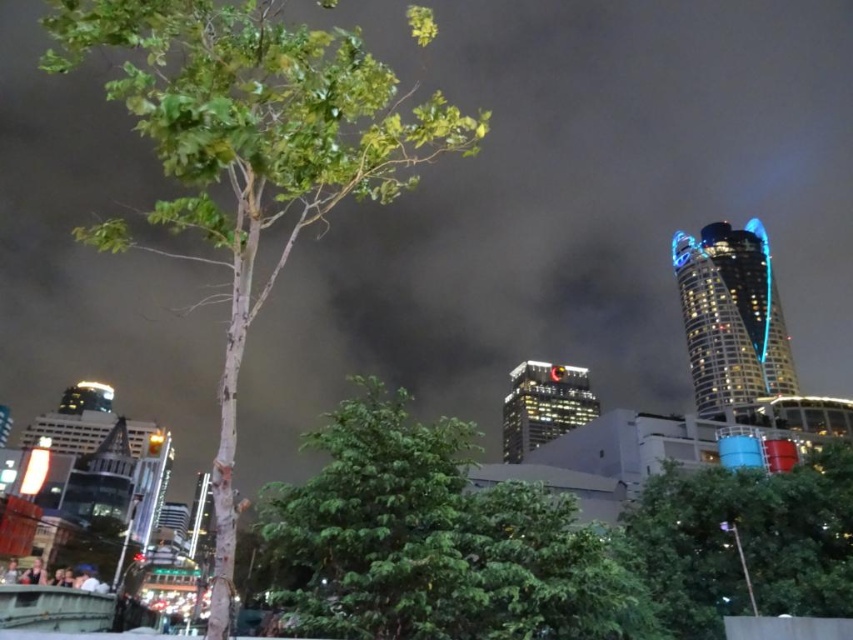
Can you confirm if green leafy tree at center is shorter than green leafy tree at lower right?

No.

Can you confirm if green leafy tree at center is wider than green leafy tree at lower right?

Indeed, green leafy tree at center has a greater width compared to green leafy tree at lower right.

Is point (471, 621) farther from camera compared to point (753, 540)?

No, it is in front of (753, 540).

You are a GUI agent. You are given a task and a screenshot of the screen. Output one action in this format:
    pyautogui.click(x=<x>, y=<y>)
    Task: Click on the green leafy tree at center
    This screenshot has height=640, width=853.
    Given the screenshot: What is the action you would take?
    (436, 541)